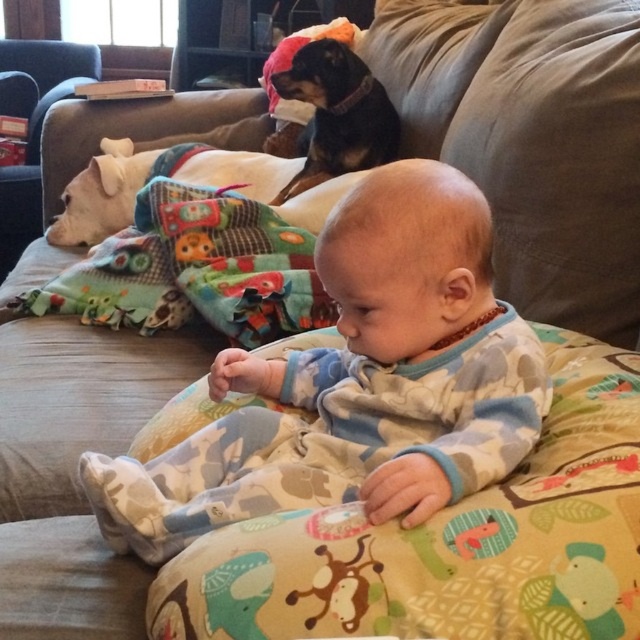
Question: Can you confirm if fluffy blue and white pajamas at center is positioned below multicolored fleece blanket at left?

Choices:
 (A) yes
 (B) no

Answer: (A)

Question: Which point is farther from the camera taking this photo?

Choices:
 (A) (17, 218)
 (B) (102, 477)
 (C) (250, 596)
 (D) (96, 321)

Answer: (A)

Question: Does multicolored fleece blanket at left have a lesser width compared to white soft dog at left?

Choices:
 (A) yes
 (B) no

Answer: (B)

Question: Which point is closer to the camera?

Choices:
 (A) printed fabric baby at center
 (B) white soft dog at left
 (C) fluffy blue and white pajamas at center

Answer: (A)

Question: Estimate the real-world distances between objects in this image. Which object is closer to the fluffy blue and white pajamas at center?

Choices:
 (A) white soft dog at left
 (B) printed fabric baby at center
 (C) multicolored fleece blanket at left

Answer: (B)

Question: Can you confirm if fluffy blue and white pajamas at center is wider than white soft dog at left?

Choices:
 (A) no
 (B) yes

Answer: (B)